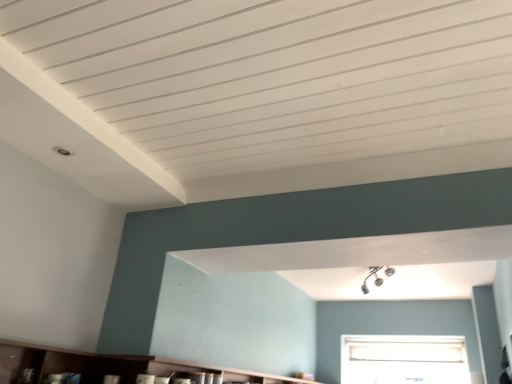
This screenshot has width=512, height=384. What do you see at coordinates (404, 359) in the screenshot? I see `white frosted glass window at center` at bounding box center [404, 359].

At what (x,y) coordinates should I click in order to perform the action: click on white frosted glass window at center. Please return your answer as a coordinate pair (x, y). Looking at the image, I should click on (404, 359).

Image resolution: width=512 pixels, height=384 pixels. In order to click on white frosted glass window at center in this screenshot , I will do `click(404, 359)`.